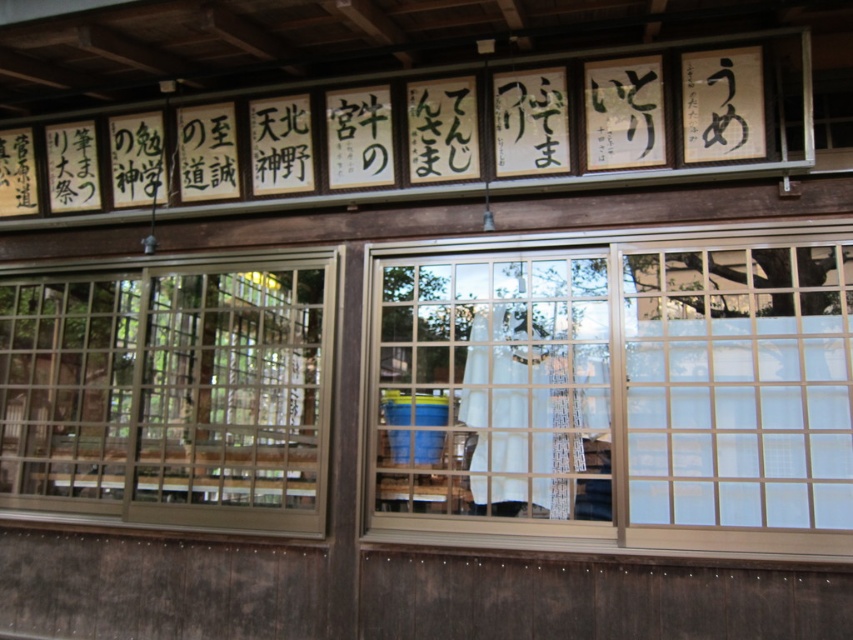
Between clear glass window at center and clear glass window at left, which one is positioned lower?

clear glass window at left

Does clear glass window at center have a greater width compared to clear glass window at left?

Yes.

Does point (766, 236) lie in front of point (312, 344)?

Yes, it is.

I want to click on clear glass window at center, so click(621, 394).